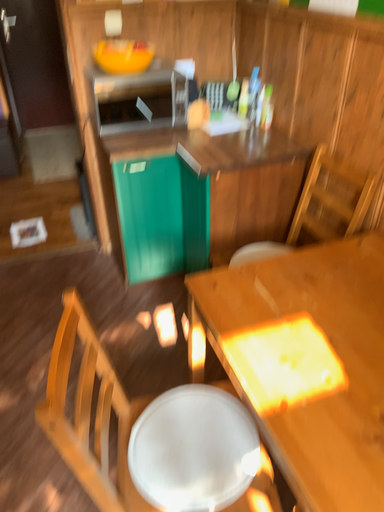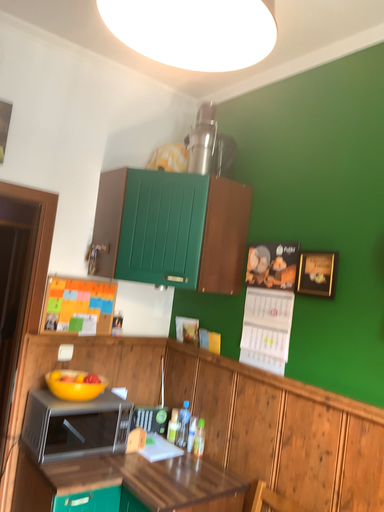
Question: Which way did the camera rotate in the video?

Choices:
 (A) rotated downward
 (B) rotated upward

Answer: (B)